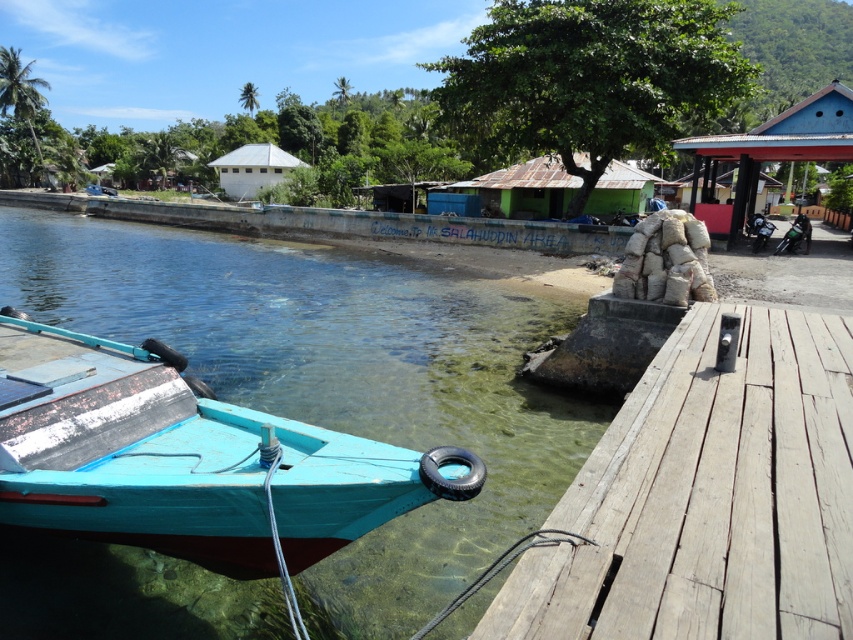
Which is behind, point (680, 497) or point (273, 150)?

Positioned behind is point (273, 150).

Is wooden planks at right bigger than white matte hut at center?

No, wooden planks at right is not bigger than white matte hut at center.

Does point (641, 515) lie behind point (256, 179)?

No, it is not.

Where is `wooden planks at right`? The height and width of the screenshot is (640, 853). wooden planks at right is located at coordinates (708, 497).

Which is above, wooden planks at right or teal wooden boat at lower left?

wooden planks at right is above.

Does wooden planks at right appear under teal wooden boat at lower left?

No, wooden planks at right is not below teal wooden boat at lower left.

Is point (838, 628) more distant than point (467, 456)?

No.

Where is `wooden planks at right`? wooden planks at right is located at coordinates (708, 497).

Can you confirm if wooden planks at right is positioned to the left of green corrugated metal hut at center?

Yes, wooden planks at right is to the left of green corrugated metal hut at center.

Is wooden planks at right taller than green corrugated metal hut at center?

No.

What do you see at coordinates (708, 497) in the screenshot? This screenshot has height=640, width=853. I see `wooden planks at right` at bounding box center [708, 497].

Find the location of a particular element. This screenshot has height=640, width=853. wooden planks at right is located at coordinates (708, 497).